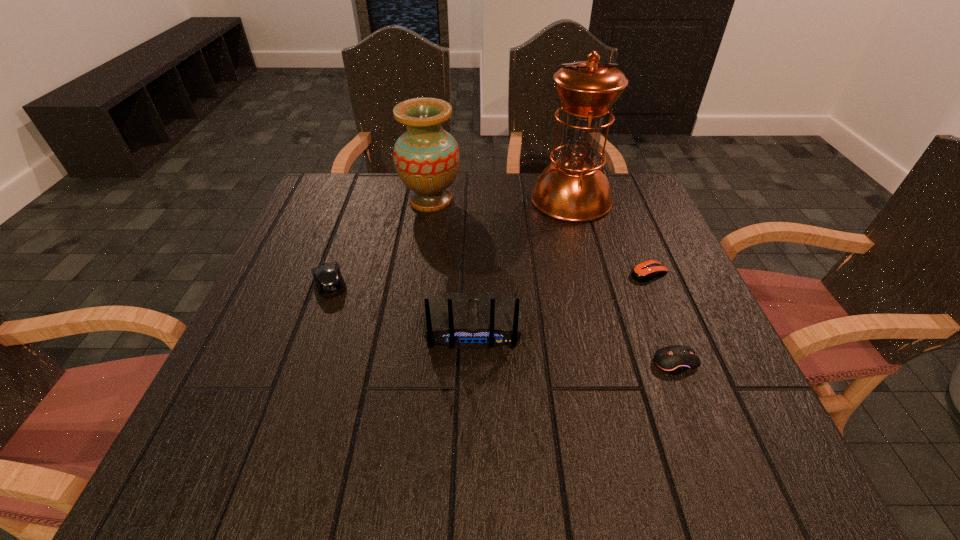
Where is `the tallest object`? the tallest object is located at coordinates (574, 188).

What are the coordinates of `vase` in the screenshot? It's located at (426, 157).

Locate an element on the screen. This screenshot has width=960, height=540. the third tallest object is located at coordinates (456, 319).

Where is `the tallest computer mouse`? This screenshot has height=540, width=960. the tallest computer mouse is located at coordinates (329, 281).

I want to click on the leftmost object, so click(x=329, y=281).

Identify the location of the second tallest computer mouse. (676, 359).

Locate an element on the screen. the fifth tallest object is located at coordinates (676, 359).

Locate an element on the screen. This screenshot has width=960, height=540. the shortest object is located at coordinates (645, 271).

Where is `free space located on the front of the tallest object`? The width and height of the screenshot is (960, 540). free space located on the front of the tallest object is located at coordinates (582, 240).

Locate an element on the screen. This screenshot has height=540, width=960. blank space located on the right of the vase is located at coordinates [523, 200].